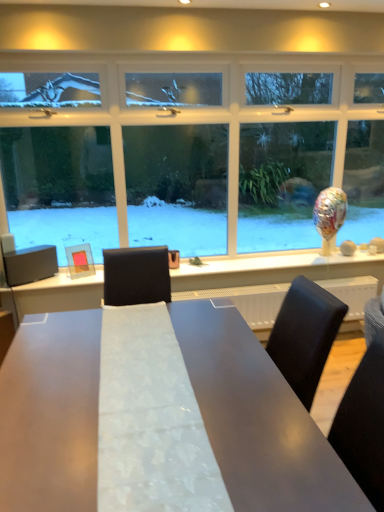
Question: Should I look upward or downward to see glossy white table at center?

Choices:
 (A) up
 (B) down

Answer: (B)